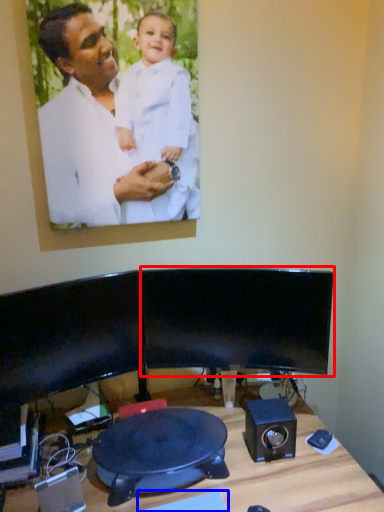
Question: Among these objects, which one is farthest to the camera, computer monitor (highlighted by a red box) or keyboard (highlighted by a blue box)?

Choices:
 (A) computer monitor
 (B) keyboard

Answer: (A)